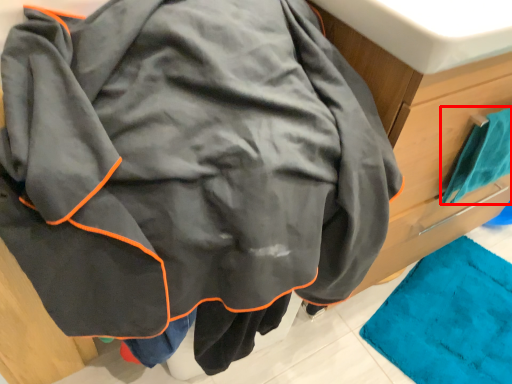
Question: From the image's perspective, considering the relative positions of towel (annotated by the red box) and sink in the image provided, where is towel (annotated by the red box) located with respect to the staircase?

Choices:
 (A) above
 (B) below

Answer: (B)